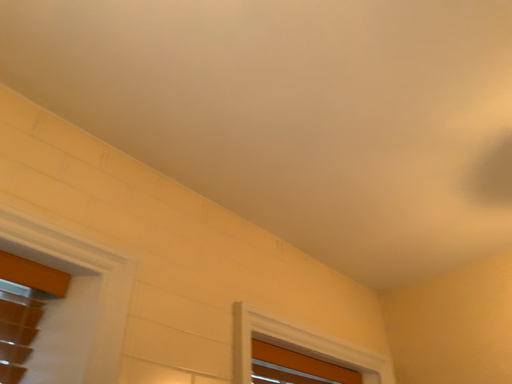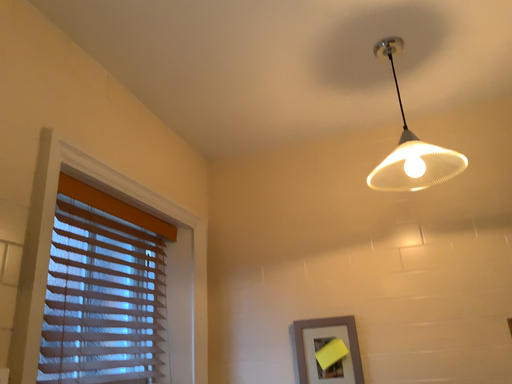
Question: How did the camera likely rotate when shooting the video?

Choices:
 (A) rotated left
 (B) rotated right

Answer: (B)